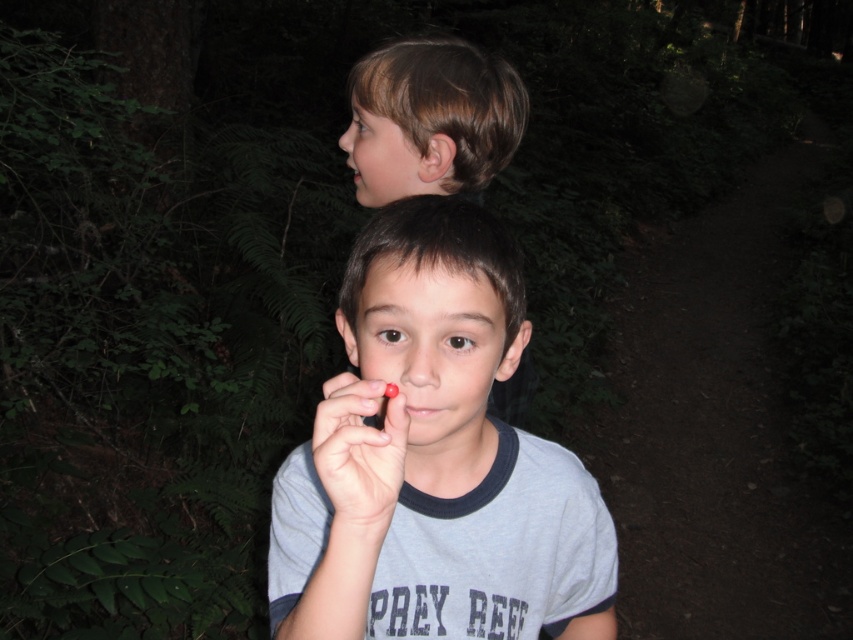
Which is above, brown hair at upper center or smooth brown hair at upper center?

brown hair at upper center is higher up.

Is point (432, 84) positioned behind point (374, 189)?

No, (432, 84) is closer to viewer.

I want to click on brown hair at upper center, so click(x=430, y=120).

Who is more distant from viewer, (436, 65) or (332, 413)?

Positioned behind is point (436, 65).

What do you see at coordinates (430, 120) in the screenshot? I see `brown hair at upper center` at bounding box center [430, 120].

What do you see at coordinates (430, 120) in the screenshot?
I see `brown hair at upper center` at bounding box center [430, 120].

I want to click on brown hair at upper center, so click(x=430, y=120).

Does smooth skin face at center have a larger size compared to smooth skin at center?

Correct, smooth skin face at center is larger in size than smooth skin at center.

Who is more distant from viewer, (396, 372) or (369, 472)?

The point (396, 372) is more distant.

Which is in front, point (363, 337) or point (386, 436)?

Point (386, 436) is in front.

Identify the location of smooth skin face at center. Image resolution: width=853 pixels, height=640 pixels. (431, 349).